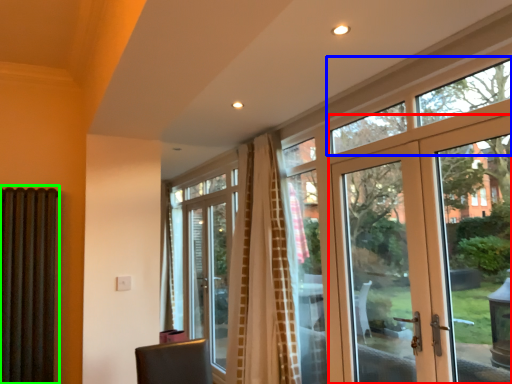
Question: Considering the real-world distances, which object is farthest from door (highlighted by a red box)? window (highlighted by a blue box) or shutter (highlighted by a green box)?

Choices:
 (A) window
 (B) shutter

Answer: (B)